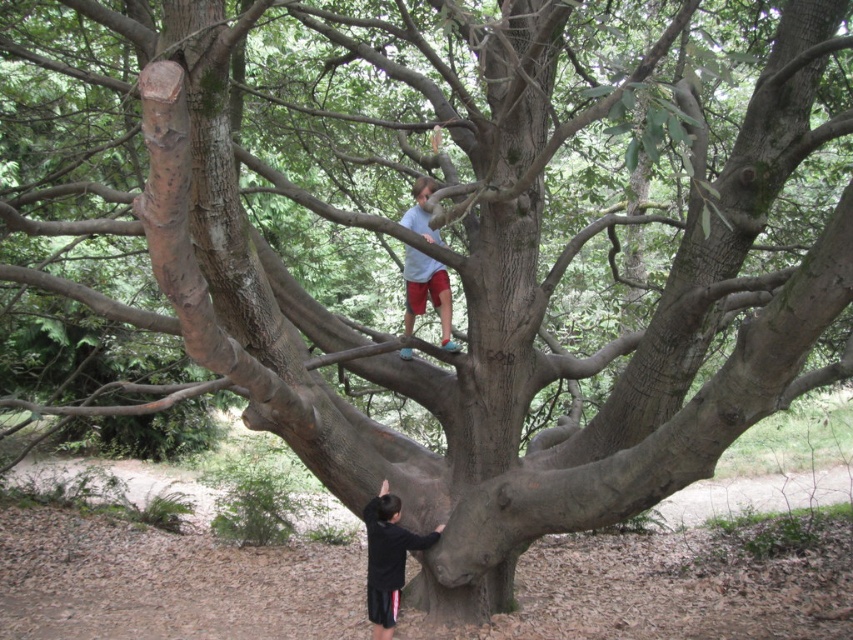
Question: Considering the relative positions of black matte shirt at lower center and light blue shirt at upper center in the image provided, where is black matte shirt at lower center located with respect to light blue shirt at upper center?

Choices:
 (A) below
 (B) above

Answer: (A)

Question: Which of the following is the closest to the observer?

Choices:
 (A) light blue shirt at upper center
 (B) black matte shirt at lower center

Answer: (B)

Question: Does black matte shirt at lower center appear on the right side of light blue shirt at upper center?

Choices:
 (A) yes
 (B) no

Answer: (B)

Question: Which point is farther to the camera?

Choices:
 (A) light blue shirt at upper center
 (B) black matte shirt at lower center

Answer: (A)

Question: Is black matte shirt at lower center to the right of light blue shirt at upper center from the viewer's perspective?

Choices:
 (A) yes
 (B) no

Answer: (B)